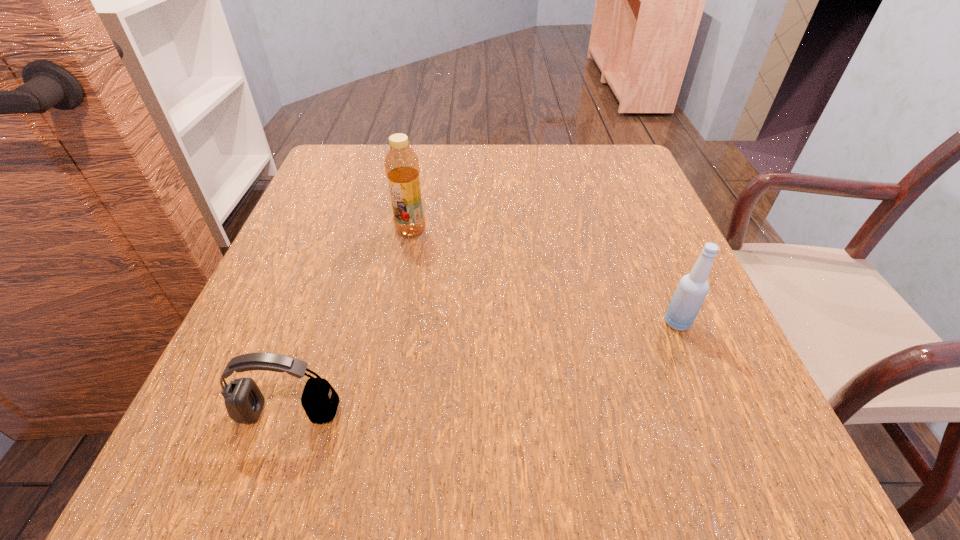
The image size is (960, 540). I want to click on vacant space that satisfies the following two spatial constraints: 1. on the front side of the taller bottle; 2. on the right side of the right bottle, so click(394, 322).

The image size is (960, 540). Find the location of `vacant region that satisfies the following two spatial constraints: 1. on the front side of the tallest object; 2. on the right side of the shorter bottle`. vacant region that satisfies the following two spatial constraints: 1. on the front side of the tallest object; 2. on the right side of the shorter bottle is located at coordinates (394, 322).